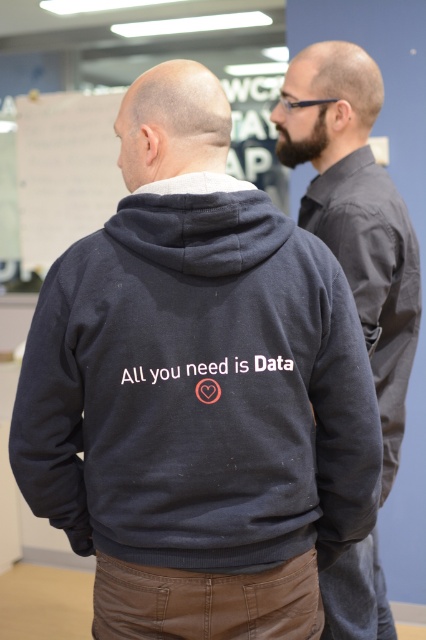
Which is above, dark blue hoodie at center or dark gray hoodie at center?

Positioned higher is dark gray hoodie at center.

Where is `dark blue hoodie at center`? The width and height of the screenshot is (426, 640). dark blue hoodie at center is located at coordinates (198, 388).